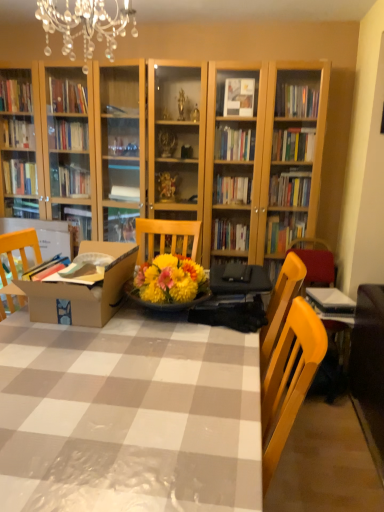
Question: Can you confirm if brown cardboard box at center is taller than yellow wood chair at right?

Choices:
 (A) no
 (B) yes

Answer: (A)

Question: Is brown cardboard box at center at the left side of yellow wood chair at right?

Choices:
 (A) no
 (B) yes

Answer: (B)

Question: Is brown cardboard box at center to the right of yellow wood chair at right from the viewer's perspective?

Choices:
 (A) yes
 (B) no

Answer: (B)

Question: Is the depth of brown cardboard box at center less than that of yellow wood chair at right?

Choices:
 (A) yes
 (B) no

Answer: (A)

Question: Can you see brown cardboard box at center touching yellow wood chair at right?

Choices:
 (A) yes
 (B) no

Answer: (B)

Question: Is brown cardboard box at center further to camera compared to yellow wood chair at right?

Choices:
 (A) no
 (B) yes

Answer: (A)

Question: Is yellow wood chair at right at the left side of wooden table at center?

Choices:
 (A) yes
 (B) no

Answer: (B)

Question: Is yellow wood chair at right outside of wooden table at center?

Choices:
 (A) yes
 (B) no

Answer: (A)

Question: Does yellow wood chair at right have a greater height compared to wooden table at center?

Choices:
 (A) no
 (B) yes

Answer: (B)

Question: From the image's perspective, is yellow wood chair at right above wooden table at center?

Choices:
 (A) no
 (B) yes

Answer: (B)

Question: Is yellow wood chair at right behind wooden table at center?

Choices:
 (A) yes
 (B) no

Answer: (A)

Question: From a real-world perspective, is yellow wood chair at right beneath wooden table at center?

Choices:
 (A) no
 (B) yes

Answer: (A)

Question: Can you confirm if brown cardboard box at center is thinner than crystal chandelier at upper center?

Choices:
 (A) no
 (B) yes

Answer: (A)